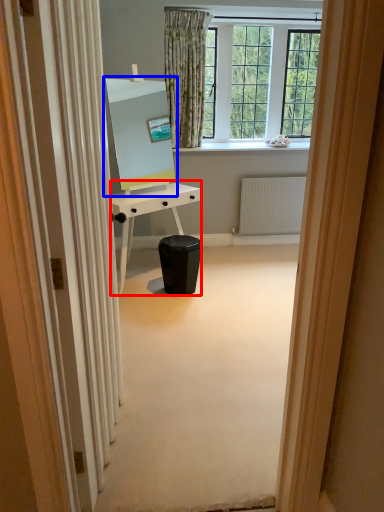
Question: Among these objects, which one is nearest to the camera, desk (highlighted by a red box) or computer monitor (highlighted by a blue box)?

Choices:
 (A) desk
 (B) computer monitor

Answer: (B)